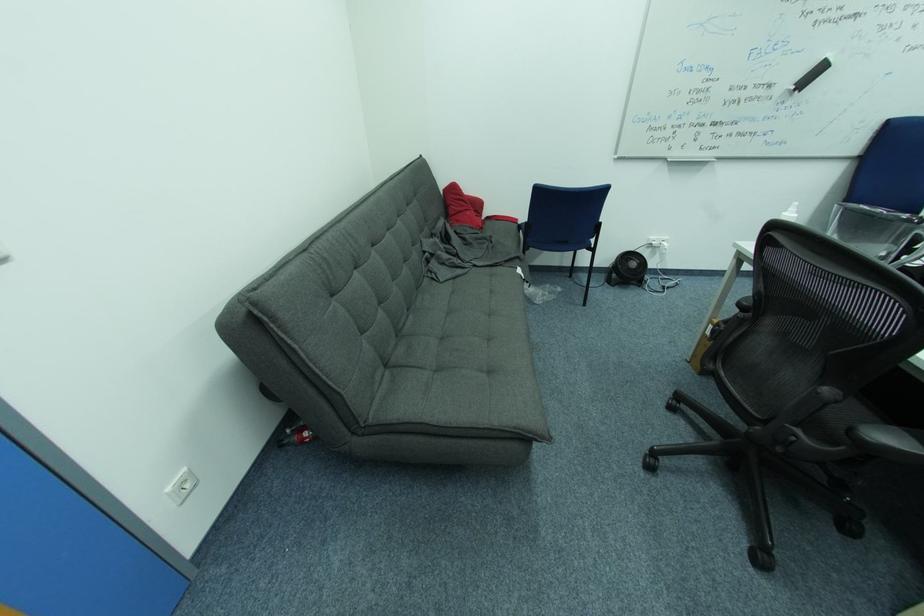
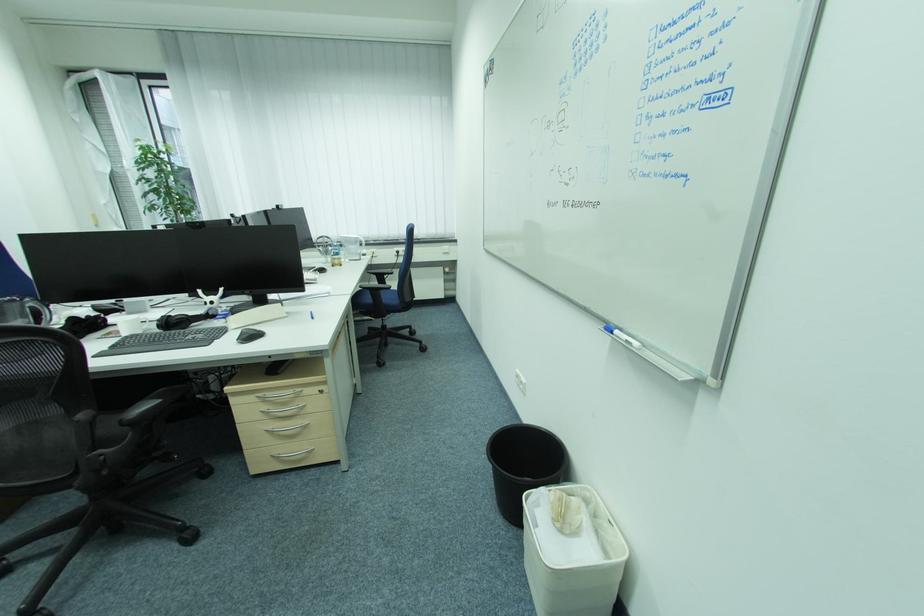
Where in the second image is the point corresponding to [858,430] from the first image?

(128, 422)